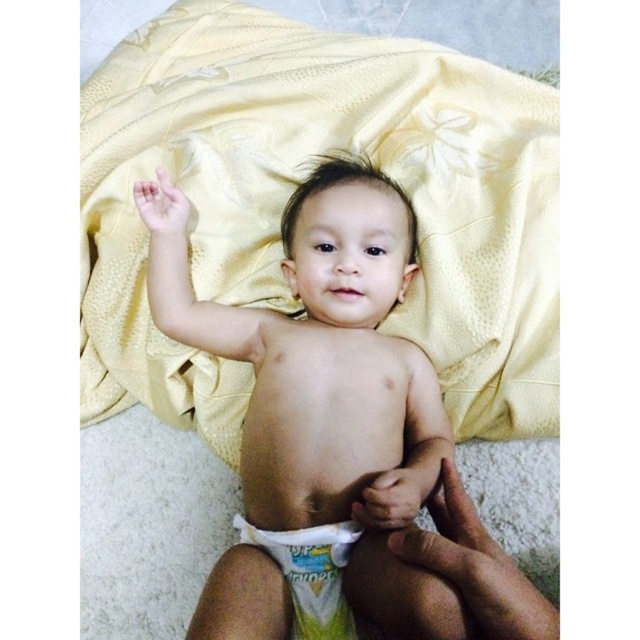
You are a photographer taking a picture of the baby. You notice two points in the scene at coordinates point (413, 368) and point (532, 625). Which point is closer to the camera?

Point (532, 625) is closer to the camera because the description states that point (413, 368) is behind point (532, 625).

You are a photographer setting up a shoot for a baby product catalog. You need to ensure that the yellow satin blanket at upper center and the white cloth diaper at center are visible in the final shot. Based on their positions, which object is closer to the camera?

The yellow satin blanket at upper center is above the white cloth diaper at center, meaning it is closer to the camera.

You are a photographer taking a closeup shot of the smooth skin baby at center and the skinny white diaper at lower center. Which object should you focus on first to ensure it appears sharp in the photo?

The smooth skin baby at center is closer to the viewer than the skinny white diaper at lower center, so you should focus on the smooth skin baby at center first to ensure it appears sharp.